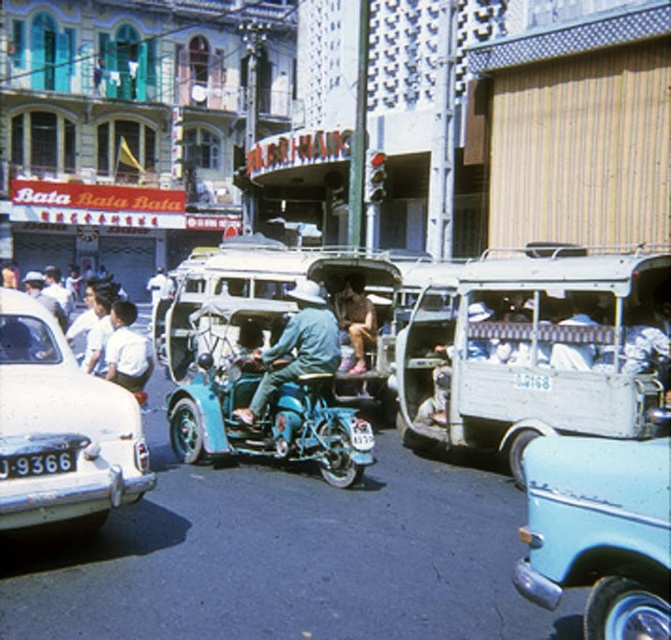
Question: Is teal matte motorcycle at center closer to the viewer compared to brown leather jacket at center?

Choices:
 (A) no
 (B) yes

Answer: (B)

Question: Which object is positioned farthest from the teal matte motorcycle at center?

Choices:
 (A) denim jacket at center
 (B) brown leather jacket at center

Answer: (B)

Question: Which point appears closest to the camera in this image?

Choices:
 (A) (482, 326)
 (B) (225, 388)

Answer: (A)

Question: Is light blue plastic tricycle at center closer to camera compared to teal matte motorcycle at center?

Choices:
 (A) yes
 (B) no

Answer: (A)

Question: Is light blue plastic tricycle at center to the right of black plastic license plate at lower left from the viewer's perspective?

Choices:
 (A) no
 (B) yes

Answer: (B)

Question: Considering the real-world distances, which object is closest to the denim jacket at center?

Choices:
 (A) black plastic license plate at lower left
 (B) teal matte motorcycle at center
 (C) brown leather jacket at center
 (D) white glossy car at lower left

Answer: (B)